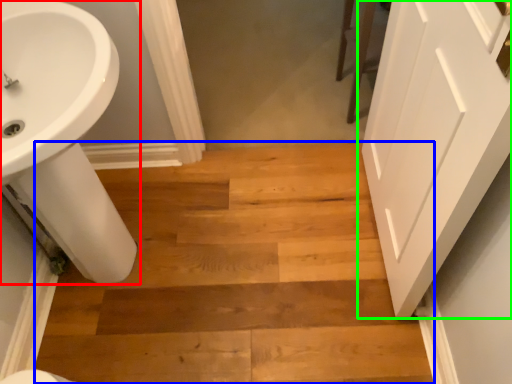
Question: Which object is positioned closest to sink (highlighted by a red box)? Select from stairwell (highlighted by a blue box) and door (highlighted by a green box).

Choices:
 (A) stairwell
 (B) door

Answer: (A)